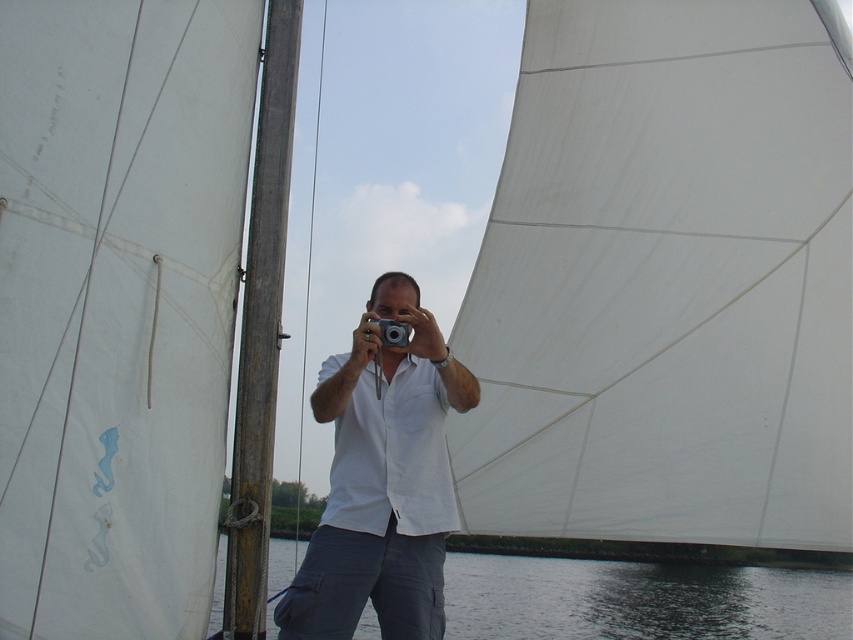
Is dark blue water at lower center taller than silver metallic camera at center?

Correct, dark blue water at lower center is much taller as silver metallic camera at center.

Is point (628, 627) less distant than point (386, 330)?

No, it is behind (386, 330).

The width and height of the screenshot is (853, 640). In order to click on dark blue water at lower center in this screenshot , I will do `click(639, 600)`.

Who is shorter, white cotton shirt at center or dark blue water at lower center?

white cotton shirt at center is shorter.

Who is lower down, white cotton shirt at center or dark blue water at lower center?

dark blue water at lower center is lower down.

Describe the element at coordinates (381, 481) in the screenshot. I see `white cotton shirt at center` at that location.

The height and width of the screenshot is (640, 853). Identify the location of white cotton shirt at center. (381, 481).

Is point (425, 484) in front of point (402, 333)?

No, (425, 484) is further to viewer.

Does white cotton shirt at center appear under silver metallic camera at center?

Correct, white cotton shirt at center is located below silver metallic camera at center.

Does point (381, 513) lie behind point (397, 330)?

Yes, point (381, 513) is behind point (397, 330).

You are a GUI agent. You are given a task and a screenshot of the screen. Output one action in this format:
    pyautogui.click(x=<x>, y=<y>)
    Task: Click on the white cotton shirt at center
    The height and width of the screenshot is (640, 853).
    Given the screenshot: What is the action you would take?
    pyautogui.click(x=381, y=481)